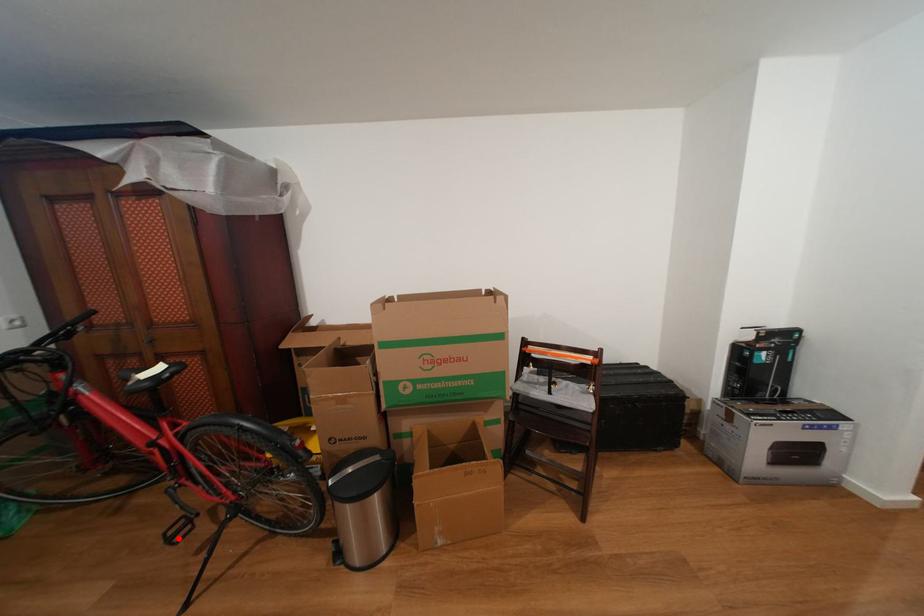
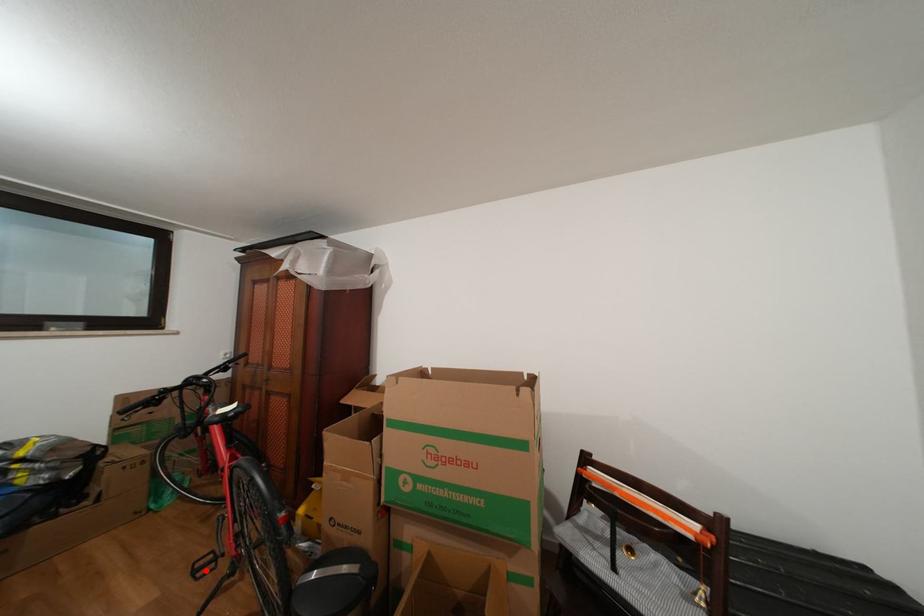
I am providing you with two images of the same scene from different viewpoints. A red point is marked on the first image and another point is marked on the second image. Is the marked point in image1 the same physical position as the marked point in image2?

Yes